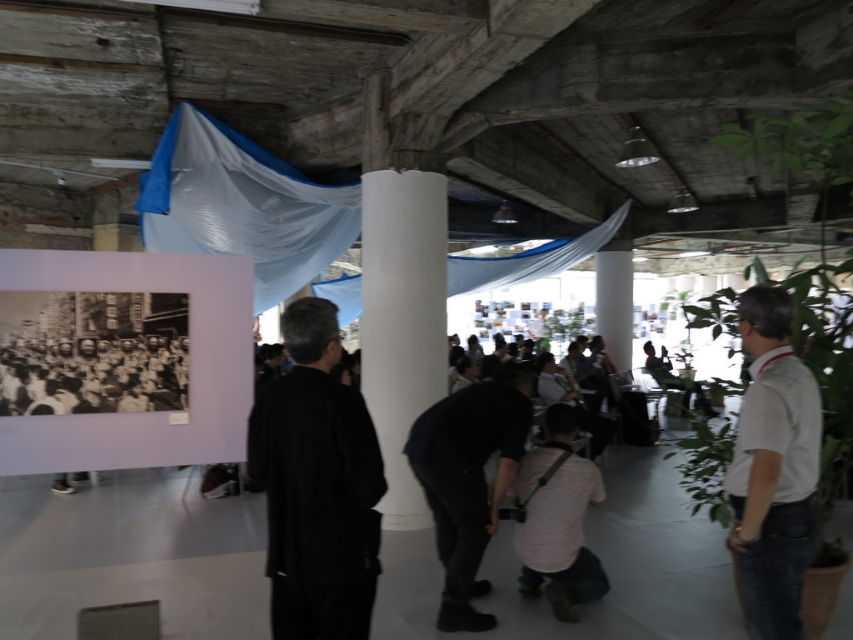
Question: Does black matte jacket at center appear under black matte shirt at center?

Choices:
 (A) yes
 (B) no

Answer: (B)

Question: Which of the following is the closest to the observer?

Choices:
 (A) (312, 616)
 (B) (766, 353)

Answer: (A)

Question: Is black matte jacket at center positioned in front of black matte shirt at center?

Choices:
 (A) no
 (B) yes

Answer: (B)

Question: Does black matte jacket at center come behind white cotton shirt at right?

Choices:
 (A) no
 (B) yes

Answer: (A)

Question: Which point is farther to the camera?

Choices:
 (A) (270, 449)
 (B) (488, 502)

Answer: (B)

Question: Among these points, which one is farthest from the camera?

Choices:
 (A) (279, 460)
 (B) (778, 388)

Answer: (B)